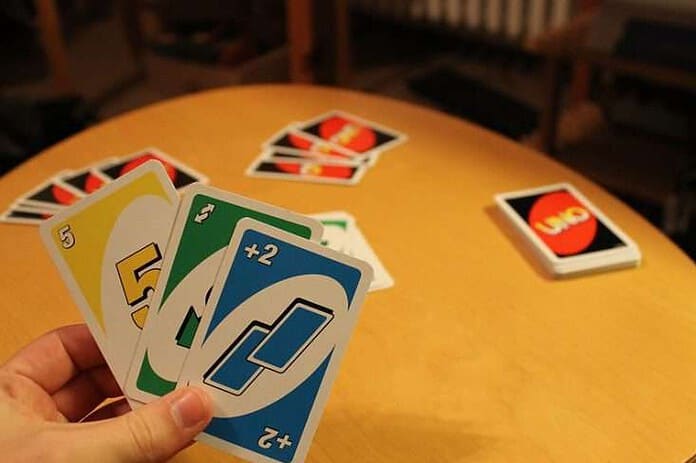
Where is `table`? This screenshot has height=463, width=696. table is located at coordinates (516, 315).